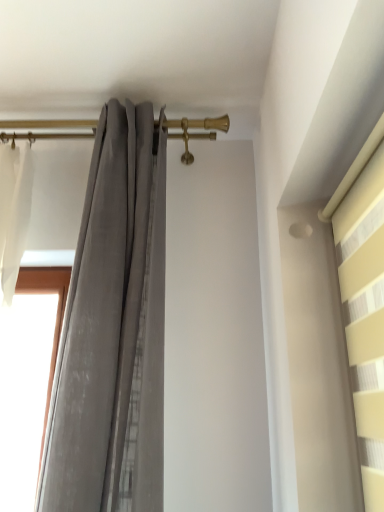
The width and height of the screenshot is (384, 512). What do you see at coordinates (113, 331) in the screenshot? I see `satin gray curtain at left` at bounding box center [113, 331].

At what (x,y) coordinates should I click in order to perform the action: click on satin gray curtain at left. Please return your answer as a coordinate pair (x, y). Looking at the image, I should click on (113, 331).

I want to click on satin gray curtain at left, so click(x=113, y=331).